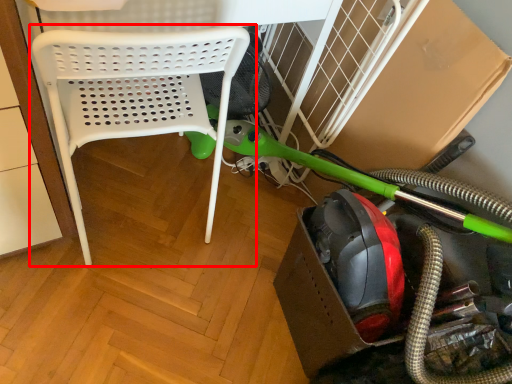
Question: Considering the relative positions of chair (annotated by the red box) and garden hose in the image provided, where is chair (annotated by the red box) located with respect to the staircase?

Choices:
 (A) right
 (B) left

Answer: (B)